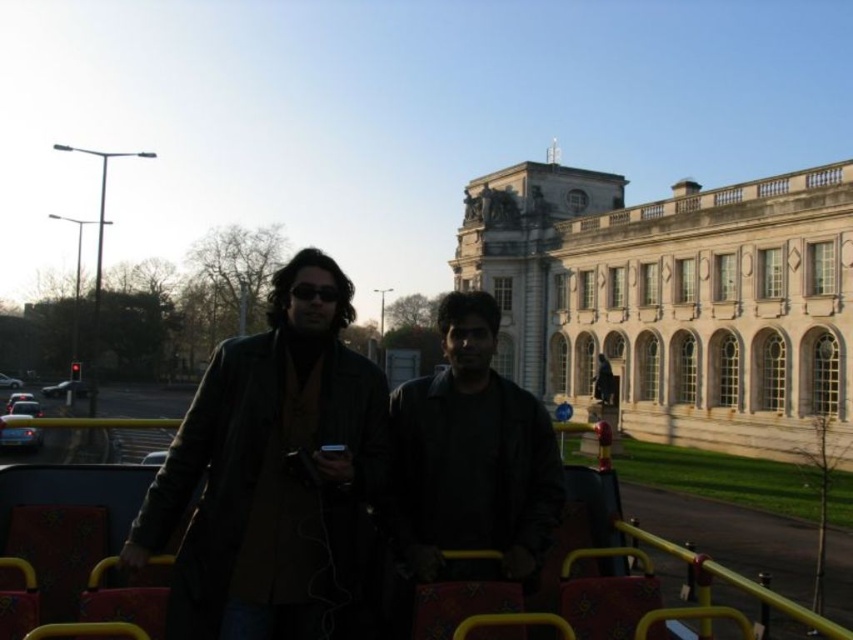
Question: Is white stone building at center to the right of black matte jacket at center from the viewer's perspective?

Choices:
 (A) no
 (B) yes

Answer: (B)

Question: Which point is farther to the camera?

Choices:
 (A) white stone building at center
 (B) black matte goggles at center

Answer: (A)

Question: Observing the image, what is the correct spatial positioning of white stone building at center in reference to black matte goggles at center?

Choices:
 (A) above
 (B) below

Answer: (A)

Question: Does matte black jacket at center have a larger size compared to black matte goggles at center?

Choices:
 (A) no
 (B) yes

Answer: (B)

Question: Which object is farther from the camera taking this photo?

Choices:
 (A) white stone building at center
 (B) black matte jacket at center
 (C) matte black jacket at center

Answer: (A)

Question: Estimate the real-world distances between objects in this image. Which object is closer to the black matte jacket at center?

Choices:
 (A) white stone building at center
 (B) black matte goggles at center

Answer: (B)